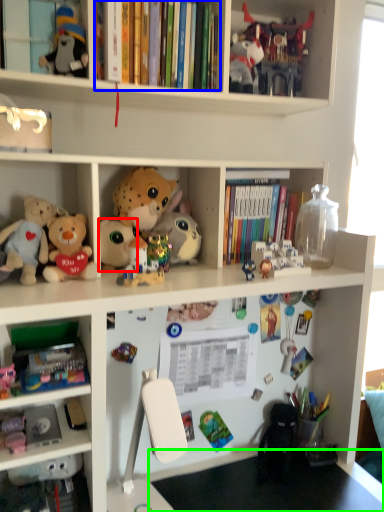
Question: Considering the real-world distances, which object is closest to toy (highlighted by a red box)? book (highlighted by a blue box) or table (highlighted by a green box).

Choices:
 (A) book
 (B) table

Answer: (A)